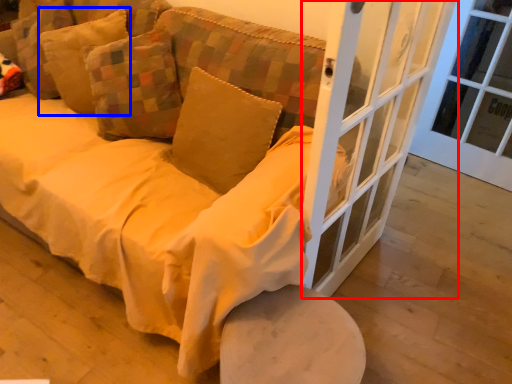
Question: Which object appears farthest to the camera in this image, screen door (highlighted by a red box) or pillow (highlighted by a blue box)?

Choices:
 (A) screen door
 (B) pillow

Answer: (B)